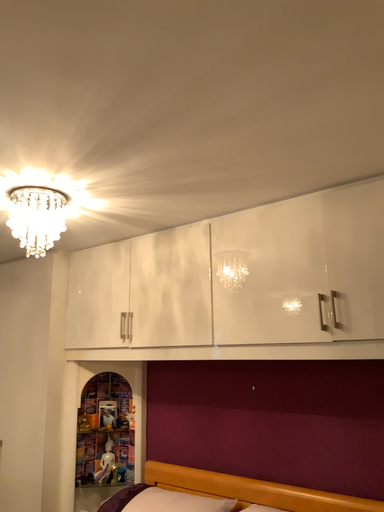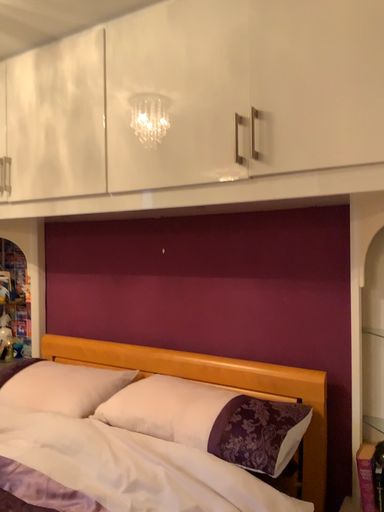
Question: Which way did the camera rotate in the video?

Choices:
 (A) rotated upward
 (B) rotated downward

Answer: (B)